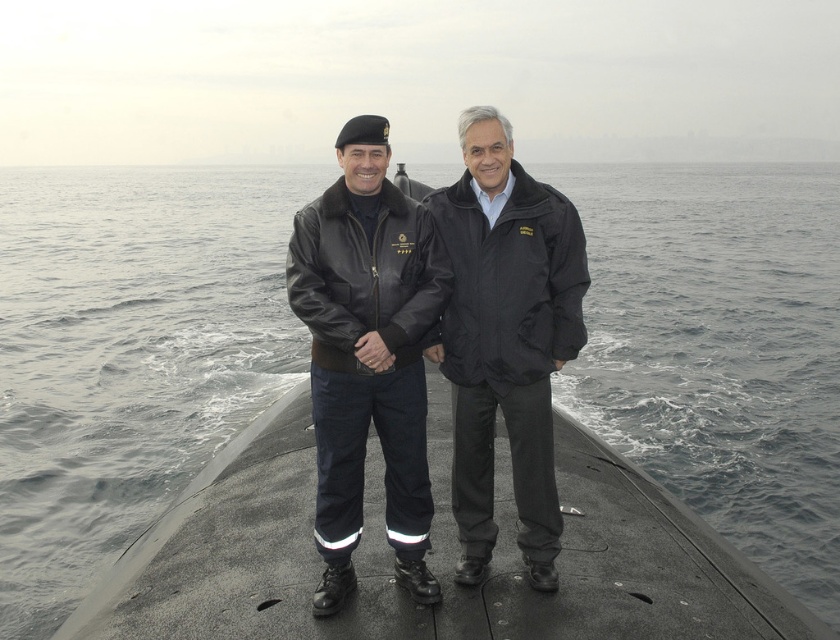
Question: Observing the image, what is the correct spatial positioning of gray water at center in reference to matte black jacket at center?

Choices:
 (A) left
 (B) right

Answer: (B)

Question: Is gray water at center behind matte black jacket at center?

Choices:
 (A) no
 (B) yes

Answer: (B)

Question: Which of the following is the closest to the observer?

Choices:
 (A) matte black jacket at center
 (B) gray water at center

Answer: (A)

Question: In this image, where is gray water at center located relative to matte black jacket at center?

Choices:
 (A) below
 (B) above

Answer: (B)

Question: Which object appears closest to the camera in this image?

Choices:
 (A) gray water at center
 (B) matte black jacket at center

Answer: (B)